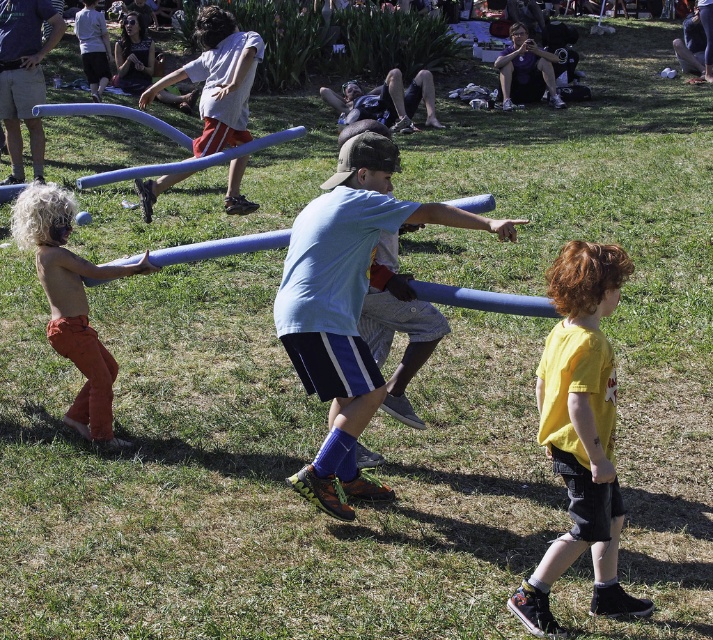
Question: Can you confirm if light blue fabric shirt at center is positioned to the left of matte blue pole at upper left?

Choices:
 (A) no
 (B) yes

Answer: (A)

Question: Is yellow matte shirt at right positioned at the back of matte black shirt at upper center?

Choices:
 (A) no
 (B) yes

Answer: (A)

Question: From the image, what is the correct spatial relationship of yellow matte shirt at right in relation to orange cotton pants at left?

Choices:
 (A) below
 (B) above

Answer: (A)

Question: Which object appears farthest from the camera in this image?

Choices:
 (A) matte black shirt at upper center
 (B) orange cotton pants at left
 (C) yellow matte shirt at right
 (D) light blue fabric shirt at center

Answer: (A)

Question: Among these objects, which one is nearest to the camera?

Choices:
 (A) orange cotton pants at left
 (B) light blue fabric shirt at center

Answer: (B)

Question: Which point appears farthest from the camera in this image?

Choices:
 (A) (550, 68)
 (B) (583, 493)
 (C) (39, 204)
 (D) (289, 264)

Answer: (A)